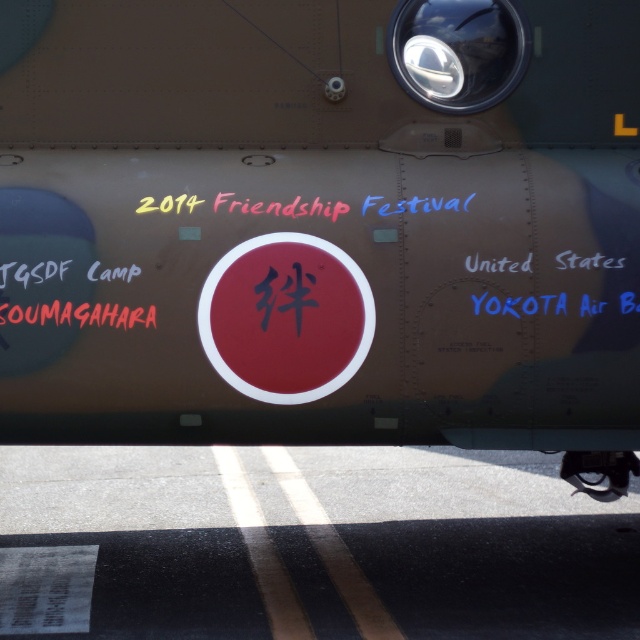
Can you confirm if black asphalt at lower center is positioned to the right of metallic silver cockpit at upper center?

In fact, black asphalt at lower center is to the left of metallic silver cockpit at upper center.

Does point (176, 616) come behind point (417, 17)?

Yes, it is behind point (417, 17).

Which is behind, point (509, 595) or point (512, 28)?

The point (509, 595) is more distant.

Locate an element on the screen. Image resolution: width=640 pixels, height=640 pixels. black asphalt at lower center is located at coordinates (317, 541).